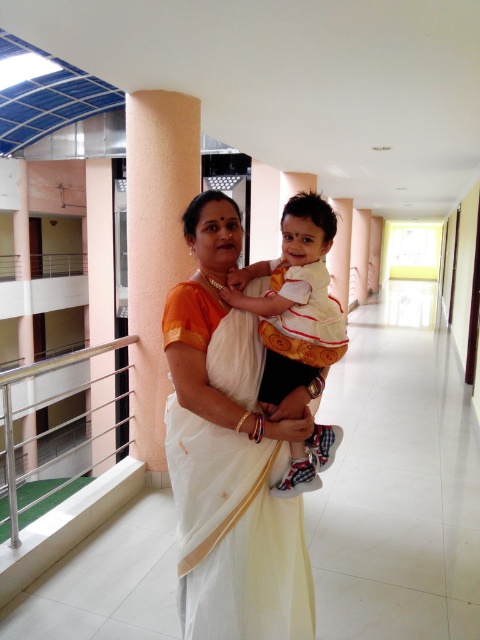
Question: Which point appears closest to the camera in this image?

Choices:
 (A) (244, 369)
 (B) (300, 227)
 (C) (163, 97)
 (D) (67, 368)

Answer: (A)

Question: Is stainless steel balustrade at left above white cotton shirt at center?

Choices:
 (A) yes
 (B) no

Answer: (B)

Question: Which object is closer to the camera taking this photo?

Choices:
 (A) orange textured pillar at center
 (B) white silk saree at center
 (C) white cotton shirt at center
 (D) stainless steel balustrade at left

Answer: (B)

Question: Is white silk saree at center bigger than white cotton shirt at center?

Choices:
 (A) no
 (B) yes

Answer: (B)

Question: Can you confirm if white silk saree at center is positioned above stainless steel balustrade at left?

Choices:
 (A) no
 (B) yes

Answer: (B)

Question: Which object appears closest to the camera in this image?

Choices:
 (A) white silk saree at center
 (B) stainless steel balustrade at left

Answer: (A)